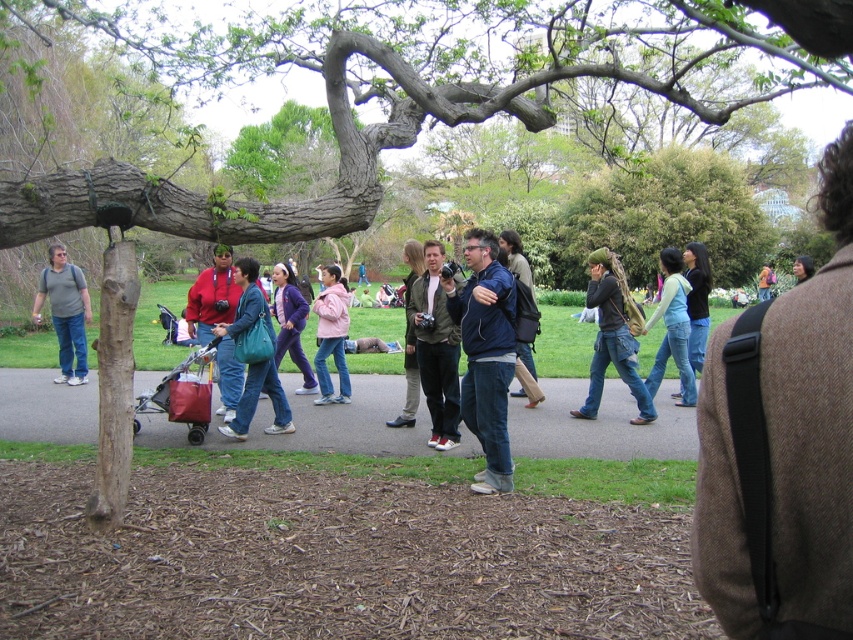
Question: Is the position of green matte jacket at center less distant than that of matte black jacket at center?

Choices:
 (A) no
 (B) yes

Answer: (B)

Question: Which point is closer to the camera taking this photo?

Choices:
 (A) (457, 310)
 (B) (531, 360)
 (C) (585, 444)

Answer: (A)

Question: Can you confirm if pink matte jacket at center is positioned to the right of black jacket at center?

Choices:
 (A) yes
 (B) no

Answer: (B)

Question: Which of the following is the closest to the observer?

Choices:
 (A) (654, 90)
 (B) (39, 280)
 (C) (317, 328)
 (D) (223, 349)

Answer: (A)

Question: Which object is farther from the camera taking this photo?

Choices:
 (A) matte gray shirt at left
 (B) matte blue jeans at center
 (C) green matte jacket at center
 (D) smooth bark tree at center

Answer: (A)

Question: Can you confirm if red fabric baby carriage at lower left is bigger than blue denim jeans at center?

Choices:
 (A) no
 (B) yes

Answer: (A)